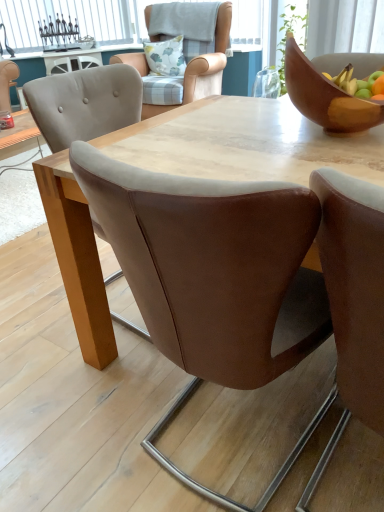
The width and height of the screenshot is (384, 512). What are the coordinates of `free space to the left of brown leather chair at center, which is the third chair in front-to-back order` in the screenshot? It's located at (34, 311).